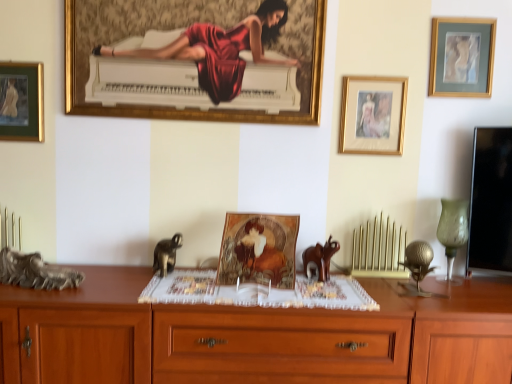
Question: Can you confirm if rustic wood sculpture at left, the 3th animal when ordered from right to left, is positioned to the left of gold-framed artwork at upper right, which is the 4th picture frame in left-to-right order?

Choices:
 (A) no
 (B) yes

Answer: (B)

Question: Is rustic wood sculpture at left, marked as the first animal in a left-to-right arrangement, closer to camera compared to gold-framed artwork at upper right, which is the 4th picture frame in left-to-right order?

Choices:
 (A) no
 (B) yes

Answer: (B)

Question: Is rustic wood sculpture at left, the 3th animal when ordered from right to left, outside gold-framed artwork at upper right, which is the 4th picture frame in left-to-right order?

Choices:
 (A) yes
 (B) no

Answer: (A)

Question: Does rustic wood sculpture at left, the 3th animal when ordered from right to left, have a greater width compared to gold-framed artwork at upper right, positioned as the first picture frame in right-to-left order?

Choices:
 (A) no
 (B) yes

Answer: (B)

Question: Does rustic wood sculpture at left, marked as the first animal in a left-to-right arrangement, touch gold-framed artwork at upper right, which is the 4th picture frame in left-to-right order?

Choices:
 (A) no
 (B) yes

Answer: (A)

Question: Is point (32, 286) closer or farther from the camera than point (58, 329)?

Choices:
 (A) farther
 (B) closer

Answer: (A)

Question: Looking at the image, does rustic wood sculpture at left, marked as the first animal in a left-to-right arrangement, seem bigger or smaller compared to wooden cabinet at lower left?

Choices:
 (A) big
 (B) small

Answer: (B)

Question: Is rustic wood sculpture at left, the 3th animal when ordered from right to left, wider or thinner than wooden cabinet at lower left?

Choices:
 (A) thin
 (B) wide

Answer: (A)

Question: Choose the correct answer: Is rustic wood sculpture at left, marked as the first animal in a left-to-right arrangement, inside wooden cabinet at lower left or outside it?

Choices:
 (A) inside
 (B) outside

Answer: (B)

Question: Is green matte picture frame at upper left, the 1th picture frame when ordered from left to right, wider or thinner than wooden cabinet at lower left?

Choices:
 (A) wide
 (B) thin

Answer: (B)

Question: Is green matte picture frame at upper left, the 1th picture frame when ordered from left to right, inside or outside of wooden cabinet at lower left?

Choices:
 (A) outside
 (B) inside

Answer: (A)

Question: Is green matte picture frame at upper left, the 4th picture frame in the right-to-left sequence, in front of or behind wooden cabinet at lower left in the image?

Choices:
 (A) behind
 (B) front

Answer: (A)

Question: From a real-world perspective, is green matte picture frame at upper left, the 4th picture frame in the right-to-left sequence, above or below wooden cabinet at lower left?

Choices:
 (A) below
 (B) above

Answer: (B)

Question: Considering their positions, is green glass vase at right located in front of or behind gold-framed artwork at upper right, positioned as the first picture frame in right-to-left order?

Choices:
 (A) front
 (B) behind

Answer: (A)

Question: Choose the correct answer: Is green glass vase at right inside gold-framed artwork at upper right, positioned as the first picture frame in right-to-left order, or outside it?

Choices:
 (A) outside
 (B) inside

Answer: (A)